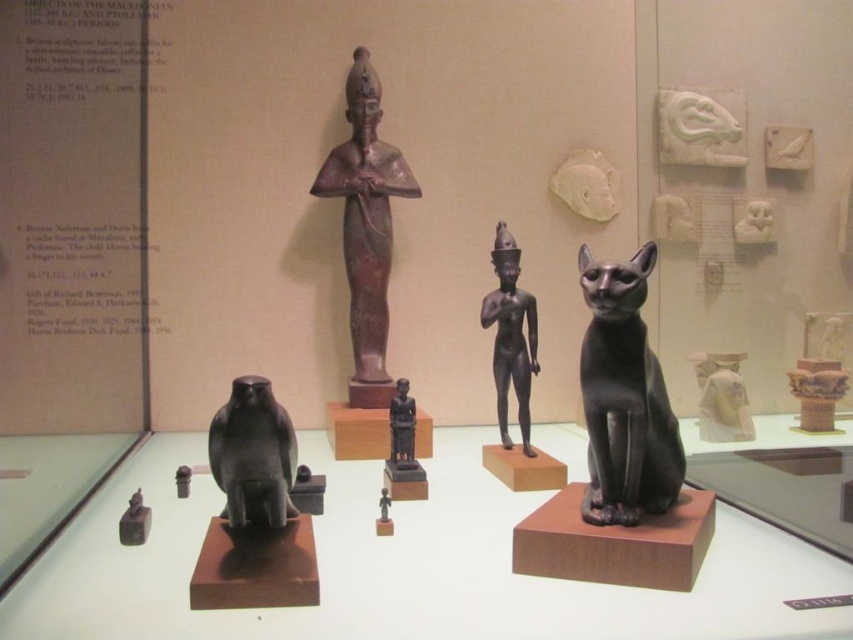
You are a museum visitor standing in front of the display case. You want to take a photo of the black glossy bird at lower left without the matte black figurine at center appearing in the background. Is this possible based on their positions?

The black glossy bird at lower left is in front of the matte black figurine at center, so yes, you can take a photo of the black glossy bird at lower left without the matte black figurine at center appearing in the background by positioning yourself so the bird blocks the view of the figurine.

You are an archaeologist examining the display case. You need to place a protective cover over the black glossy bird at lower left and the matte black figurine at center. Based on their positions, which object should you cover first to ensure the cover doesn

The black glossy bird at lower left should be covered first since it is positioned to the left of the matte black figurine at center, meaning it is closer to the left side of the display case. This allows you to start from the leftmost item and work your way right for efficient coverage.

You are a visitor standing in front of the display case. You notice two points marked in the scene at coordinates point (265, 403) and point (402, 435). Which point is closer to you?

Point (265, 403) is closer to the camera than point (402, 435), so the point closer to you is point (265, 403).